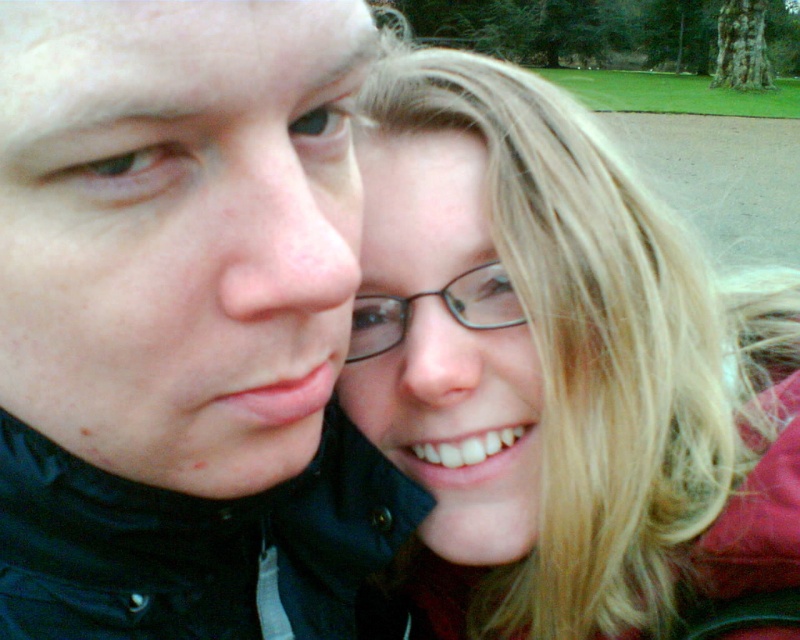
Can you confirm if smooth blonde hair at center is thinner than matte black jacket at left?

No, smooth blonde hair at center is not thinner than matte black jacket at left.

Does smooth blonde hair at center have a greater height compared to matte black jacket at left?

Yes.

You are a GUI agent. You are given a task and a screenshot of the screen. Output one action in this format:
    pyautogui.click(x=<x>, y=<y>)
    Task: Click on the smooth blonde hair at center
    This screenshot has height=640, width=800.
    Given the screenshot: What is the action you would take?
    pyautogui.click(x=560, y=371)

Is point (241, 480) positioned in front of point (358, 305)?

Yes, point (241, 480) is in front of point (358, 305).

This screenshot has height=640, width=800. Describe the element at coordinates (178, 230) in the screenshot. I see `matte black jacket at left` at that location.

At what (x,y) coordinates should I click in order to perform the action: click on matte black jacket at left. Please return your answer as a coordinate pair (x, y). Looking at the image, I should click on (178, 230).

You are a GUI agent. You are given a task and a screenshot of the screen. Output one action in this format:
    pyautogui.click(x=<x>, y=<y>)
    Task: Click on the matte black jacket at left
    The height and width of the screenshot is (640, 800).
    Given the screenshot: What is the action you would take?
    pos(178,230)

Can you confirm if smooth blonde hair at center is positioned above black plastic glasses at center?

No, smooth blonde hair at center is not above black plastic glasses at center.

Where is `smooth blonde hair at center`? smooth blonde hair at center is located at coordinates (560, 371).